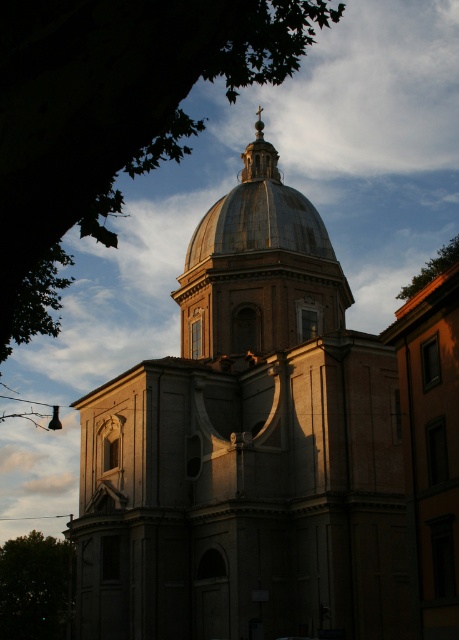
Is gray stone dome at center below shiny metallic dome at center?

Correct, gray stone dome at center is located below shiny metallic dome at center.

This screenshot has width=459, height=640. In order to click on gray stone dome at center in this screenshot , I will do `click(247, 451)`.

Is the position of gray stone dome at center more distant than that of green leafy tree at lower left?

No, gray stone dome at center is in front of green leafy tree at lower left.

At what (x,y) coordinates should I click in order to perform the action: click on gray stone dome at center. Please return your answer as a coordinate pair (x, y). Looking at the image, I should click on (247, 451).

Between gray stone dome at center and gold textured dome at center, which one appears on the left side from the viewer's perspective?

From the viewer's perspective, gray stone dome at center appears more on the left side.

Can you confirm if gray stone dome at center is taller than gold textured dome at center?

Yes.

The width and height of the screenshot is (459, 640). I want to click on gray stone dome at center, so click(x=247, y=451).